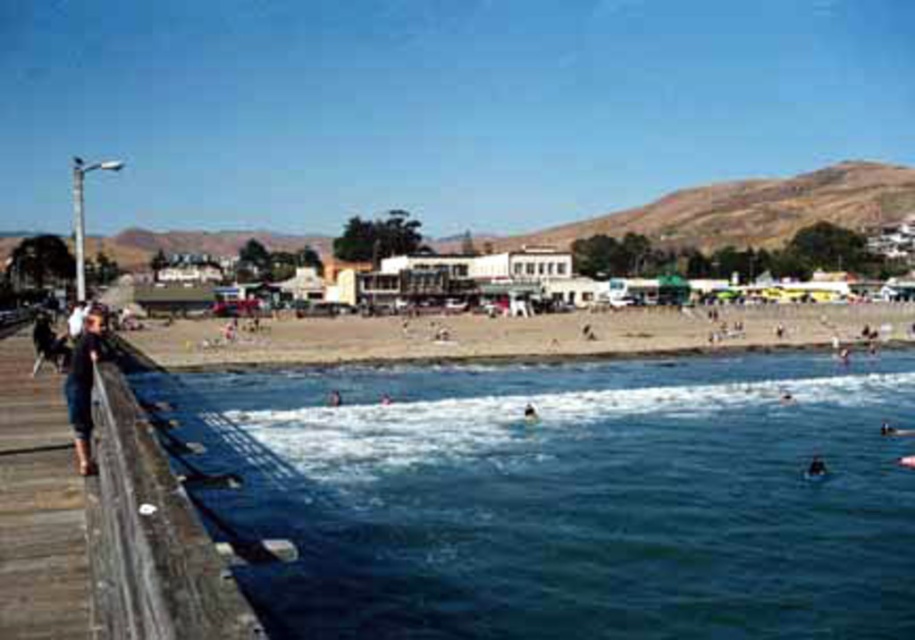
Does dark blue jeans at left have a lesser height compared to dark blue fabric swimmer at lower center?

Incorrect, dark blue jeans at left's height does not fall short of dark blue fabric swimmer at lower center's.

Which is more to the left, dark blue jeans at left or dark blue fabric swimmer at lower center?

dark blue jeans at left is more to the left.

You are a GUI agent. You are given a task and a screenshot of the screen. Output one action in this format:
    pyautogui.click(x=<x>, y=<y>)
    Task: Click on the dark blue jeans at left
    This screenshot has height=640, width=915.
    Given the screenshot: What is the action you would take?
    pyautogui.click(x=83, y=384)

The height and width of the screenshot is (640, 915). What do you see at coordinates (89, 534) in the screenshot?
I see `wooden dock at lower left` at bounding box center [89, 534].

Between wooden dock at lower left and dark blue skin at lower right, which one appears on the left side from the viewer's perspective?

wooden dock at lower left

Which is in front, point (0, 513) or point (813, 476)?

Point (0, 513) is in front.

You are a GUI agent. You are given a task and a screenshot of the screen. Output one action in this format:
    pyautogui.click(x=<x>, y=<y>)
    Task: Click on the wooden dock at lower left
    
    Given the screenshot: What is the action you would take?
    pyautogui.click(x=89, y=534)

Between blue water at lower center and wooden dock at lower left, which one appears on the right side from the viewer's perspective?

From the viewer's perspective, blue water at lower center appears more on the right side.

You are a GUI agent. You are given a task and a screenshot of the screen. Output one action in this format:
    pyautogui.click(x=<x>, y=<y>)
    Task: Click on the blue water at lower center
    
    Given the screenshot: What is the action you would take?
    pyautogui.click(x=567, y=497)

Which is behind, point (650, 560) or point (1, 344)?

Point (1, 344)

Identify the location of blue water at lower center. Image resolution: width=915 pixels, height=640 pixels. (567, 497).